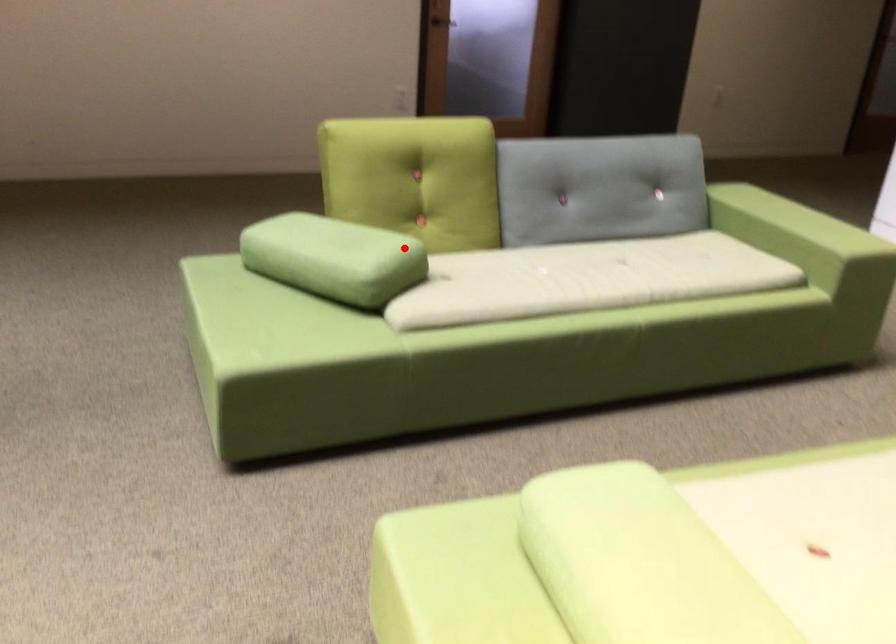
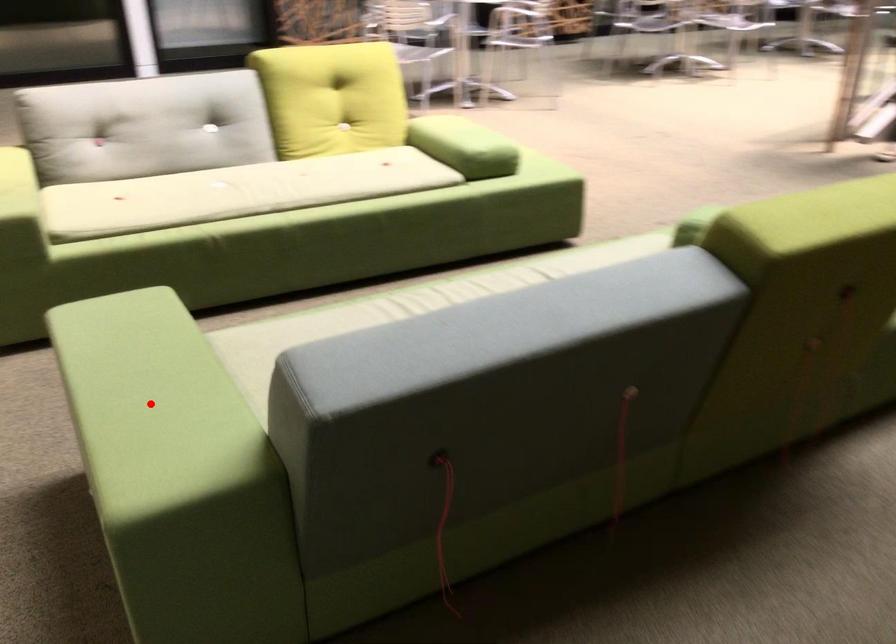
I am providing you with two images of the same scene from different viewpoints. A red point is marked on the first image and another point is marked on the second image. Does the point marked in image1 correspond to the same location as the one in image2?

No